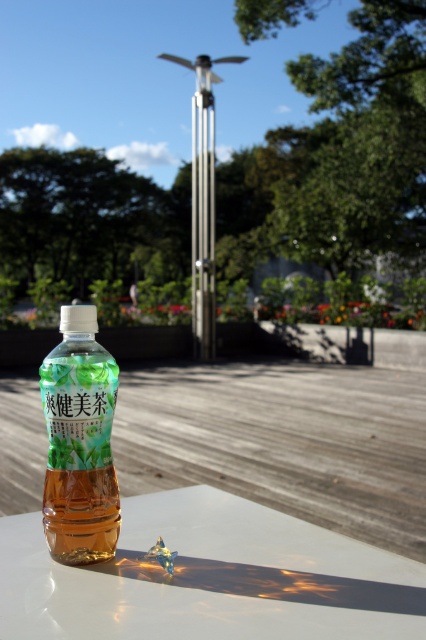
From the picture: Who is lower down, white glossy table at lower center or translucent plastic bottle at center?

white glossy table at lower center is below.

Is point (279, 534) positioned before point (68, 531)?

No, (279, 534) is further to viewer.

Find the location of `white glossy table at lower center`. white glossy table at lower center is located at coordinates (210, 579).